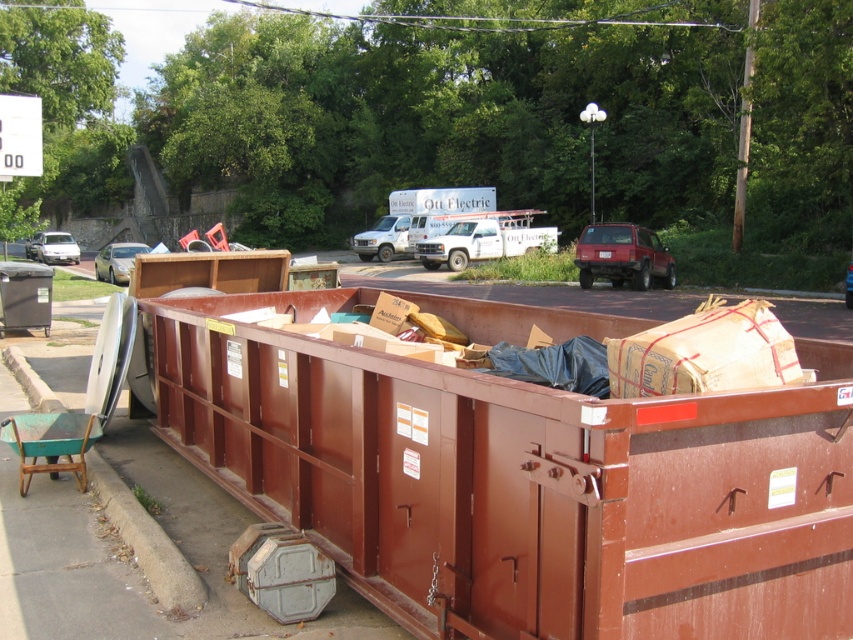
Question: Which object is the farthest from the brown matte container at center?

Choices:
 (A) brown concrete curb at lower left
 (B) metallic silver car at center
 (C) shiny silver sedan at left
 (D) red matte suv at center

Answer: (C)

Question: Is brown concrete curb at lower left below matte white car at left?

Choices:
 (A) no
 (B) yes

Answer: (B)

Question: Estimate the real-world distances between objects in this image. Which object is closer to the white matte van at center?

Choices:
 (A) metallic silver car at center
 (B) matte white car at left
 (C) brown matte container at center

Answer: (B)

Question: Which object is positioned farthest from the shiny silver sedan at left?

Choices:
 (A) white matte van at center
 (B) brown concrete curb at lower left
 (C) matte white car at left

Answer: (B)

Question: Can you confirm if shiny silver sedan at left is thinner than metallic silver car at center?

Choices:
 (A) yes
 (B) no

Answer: (B)

Question: Can you confirm if red matte suv at center is positioned to the right of metallic silver car at center?

Choices:
 (A) yes
 (B) no

Answer: (B)